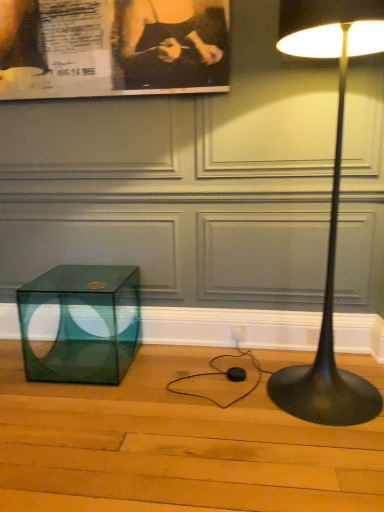
Locate an element on the screen. The image size is (384, 512). unoccupied area in front of black matte floor lamp at right is located at coordinates (315, 460).